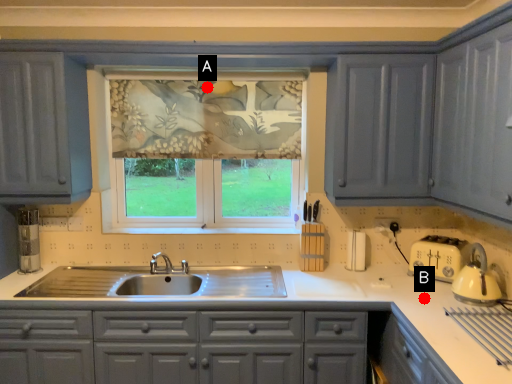
Question: Two points are circled on the image, labeled by A and B beside each circle. Which point appears farthest from the camera in this image?

Choices:
 (A) A is further
 (B) B is further

Answer: (A)